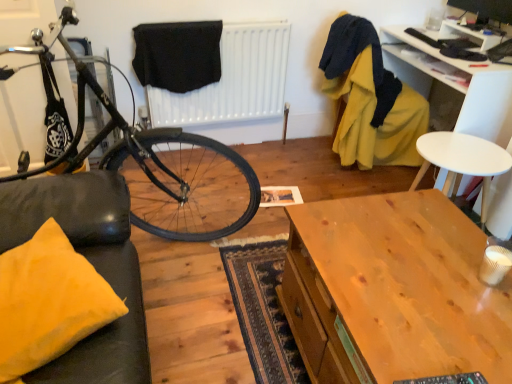
Question: Considering the relative sizes of yellow fabric armchair at upper right and shiny black bicycle at left in the image provided, is yellow fabric armchair at upper right taller than shiny black bicycle at left?

Choices:
 (A) no
 (B) yes

Answer: (A)

Question: From the image's perspective, would you say yellow fabric armchair at upper right is positioned over shiny black bicycle at left?

Choices:
 (A) no
 (B) yes

Answer: (B)

Question: Does yellow fabric armchair at upper right have a lesser width compared to shiny black bicycle at left?

Choices:
 (A) yes
 (B) no

Answer: (A)

Question: Is yellow fabric armchair at upper right positioned far away from shiny black bicycle at left?

Choices:
 (A) yes
 (B) no

Answer: (A)

Question: Is yellow fabric armchair at upper right further to camera compared to shiny black bicycle at left?

Choices:
 (A) no
 (B) yes

Answer: (B)

Question: Is yellow fabric pillow at lower left spatially inside shiny black bicycle at left, or outside of it?

Choices:
 (A) outside
 (B) inside

Answer: (A)

Question: From a real-world perspective, is yellow fabric pillow at lower left positioned above or below shiny black bicycle at left?

Choices:
 (A) below
 (B) above

Answer: (A)

Question: Considering their positions, is yellow fabric pillow at lower left located in front of or behind shiny black bicycle at left?

Choices:
 (A) behind
 (B) front

Answer: (A)

Question: Is point (54, 334) positioned closer to the camera than point (158, 162)?

Choices:
 (A) farther
 (B) closer

Answer: (B)

Question: Looking at their shapes, would you say black fabric at center is wider or thinner than wooden desk at center, the 2th desk positioned from the top?

Choices:
 (A) wide
 (B) thin

Answer: (B)

Question: Is black fabric at center taller or shorter than wooden desk at center, which is the 2th desk in right-to-left order?

Choices:
 (A) short
 (B) tall

Answer: (A)

Question: Considering their positions, is black fabric at center located in front of or behind wooden desk at center, the 1th desk from the front?

Choices:
 (A) behind
 (B) front

Answer: (A)

Question: From the image's perspective, is black fabric at center above or below wooden desk at center, the 1th desk from the front?

Choices:
 (A) below
 (B) above

Answer: (B)

Question: From the image's perspective, is white plastic chair at upper right, placed as the second desk when sorted from left to right, above or below black fabric at upper center?

Choices:
 (A) above
 (B) below

Answer: (B)

Question: From a real-world perspective, is white plastic chair at upper right, which is the 1th desk in top-to-bottom order, above or below black fabric at upper center?

Choices:
 (A) above
 (B) below

Answer: (B)